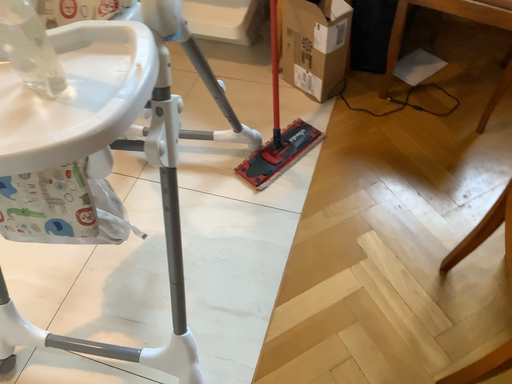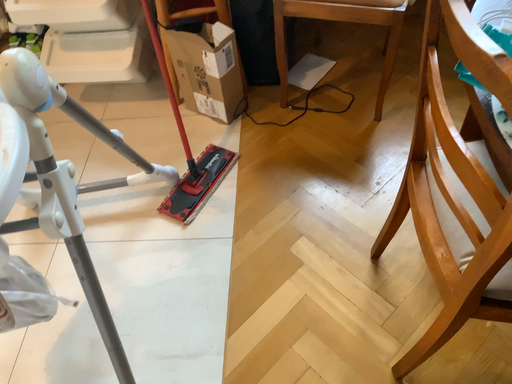
Question: How did the camera likely rotate when shooting the video?

Choices:
 (A) rotated right
 (B) rotated left

Answer: (A)